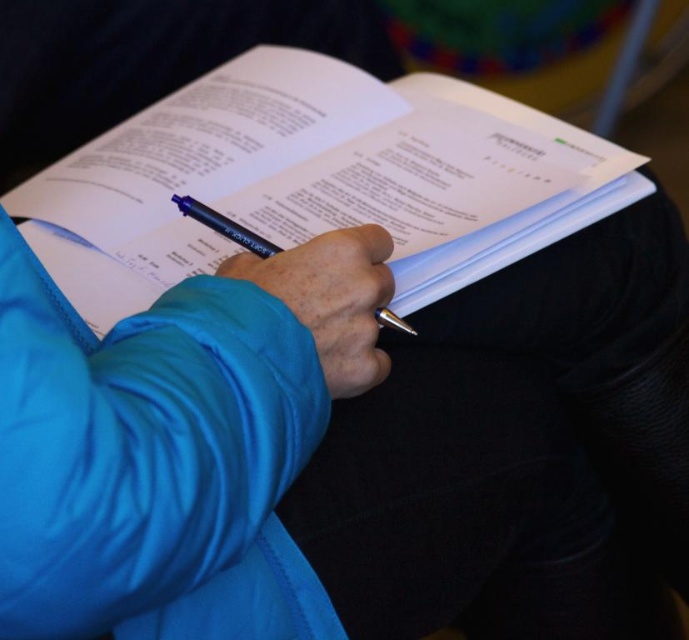
In the scene shown: How much distance is there between white paper at center and blue fabric hand at center?

white paper at center and blue fabric hand at center are 8.11 inches apart.

Locate an element on the screen. The image size is (689, 640). white paper at center is located at coordinates (316, 180).

At what (x,y) coordinates should I click in order to perform the action: click on white paper at center. Please return your answer as a coordinate pair (x, y). Looking at the image, I should click on (316, 180).

The width and height of the screenshot is (689, 640). In order to click on white paper at center in this screenshot , I will do `click(316, 180)`.

Is white paper at center bigger than metallic blue pen at center?

Yes.

Does point (194, 250) come in front of point (400, 323)?

No.

Which is behind, point (339, 80) or point (209, 209)?

The point (339, 80) is behind.

The image size is (689, 640). I want to click on white paper at center, so click(x=316, y=180).

Image resolution: width=689 pixels, height=640 pixels. What are the coordinates of `blue fabric hand at center` in the screenshot? It's located at (331, 300).